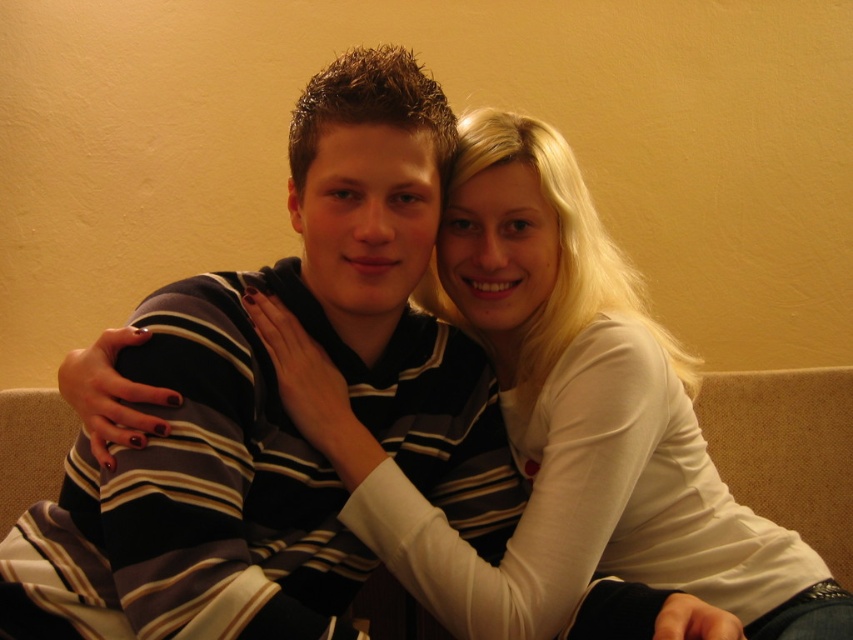
Question: Is striped cotton shirt at center further to camera compared to white matte shirt at upper right?

Choices:
 (A) no
 (B) yes

Answer: (A)

Question: Does striped cotton shirt at center appear over white matte shirt at upper right?

Choices:
 (A) no
 (B) yes

Answer: (A)

Question: Which object appears closest to the camera in this image?

Choices:
 (A) white matte shirt at upper right
 (B) striped cotton shirt at center

Answer: (B)

Question: Is striped cotton shirt at center bigger than white matte shirt at upper right?

Choices:
 (A) yes
 (B) no

Answer: (B)

Question: Which of the following is the farthest from the observer?

Choices:
 (A) white matte shirt at upper right
 (B) striped cotton shirt at center

Answer: (A)